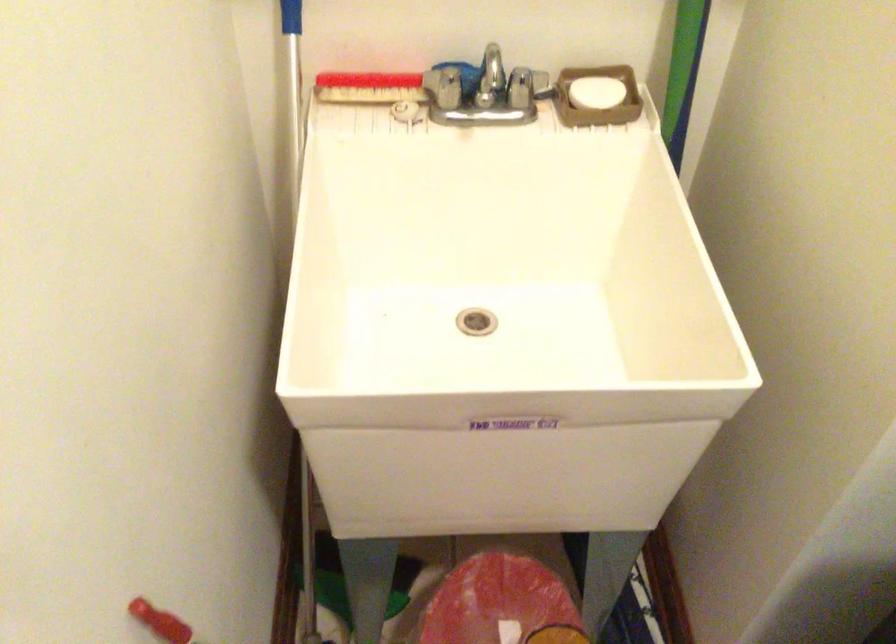
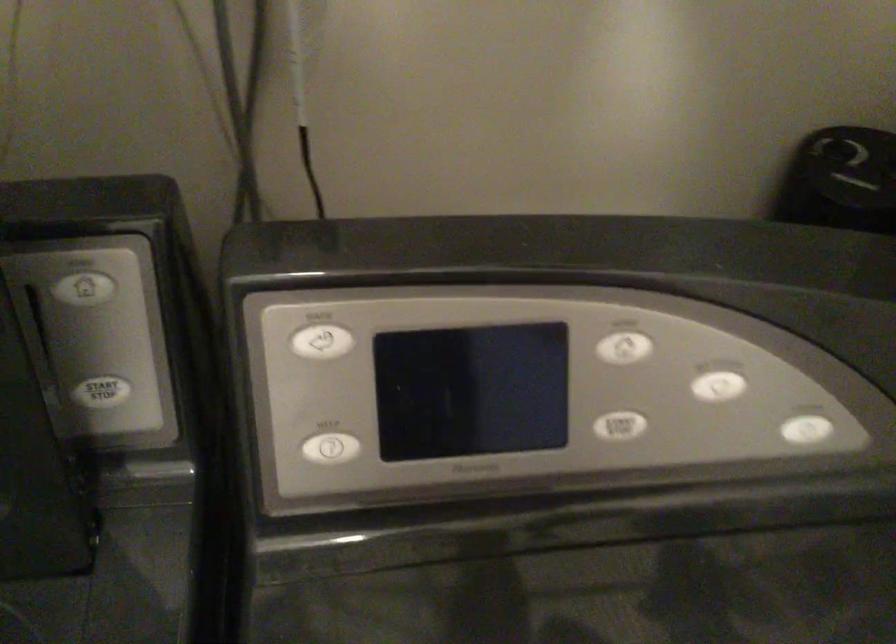
How did the camera likely rotate?

The camera's rotation is toward right-down.